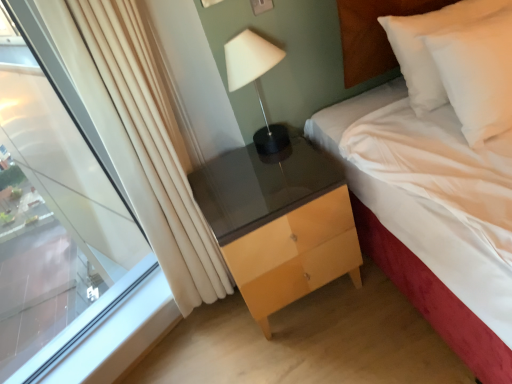
Question: Is white soft pillow at upper right at the right side of transparent glass window at left?

Choices:
 (A) no
 (B) yes

Answer: (B)

Question: Considering the relative sizes of white soft pillow at upper right and transparent glass window at left in the image provided, is white soft pillow at upper right wider than transparent glass window at left?

Choices:
 (A) yes
 (B) no

Answer: (A)

Question: Considering the relative sizes of white soft pillow at upper right and transparent glass window at left in the image provided, is white soft pillow at upper right shorter than transparent glass window at left?

Choices:
 (A) no
 (B) yes

Answer: (B)

Question: Is white soft pillow at upper right taller than transparent glass window at left?

Choices:
 (A) yes
 (B) no

Answer: (B)

Question: Does white soft pillow at upper right have a smaller size compared to transparent glass window at left?

Choices:
 (A) no
 (B) yes

Answer: (B)

Question: Is transparent glass window at left in front of or behind matte wood chest of drawers at center in the image?

Choices:
 (A) behind
 (B) front

Answer: (B)

Question: Considering the positions of transparent glass window at left and matte wood chest of drawers at center in the image, is transparent glass window at left bigger or smaller than matte wood chest of drawers at center?

Choices:
 (A) small
 (B) big

Answer: (B)

Question: In terms of width, does transparent glass window at left look wider or thinner when compared to matte wood chest of drawers at center?

Choices:
 (A) wide
 (B) thin

Answer: (B)

Question: From a real-world perspective, relative to matte wood chest of drawers at center, is transparent glass window at left vertically above or below?

Choices:
 (A) below
 (B) above

Answer: (B)

Question: From the image's perspective, is matte wood chest of drawers at center located above or below transparent glass window at left?

Choices:
 (A) below
 (B) above

Answer: (A)

Question: Is matte wood chest of drawers at center inside or outside of transparent glass window at left?

Choices:
 (A) inside
 (B) outside

Answer: (B)

Question: Looking at the image, does matte wood chest of drawers at center seem bigger or smaller compared to transparent glass window at left?

Choices:
 (A) small
 (B) big

Answer: (A)

Question: In the image, is matte wood chest of drawers at center positioned in front of or behind transparent glass window at left?

Choices:
 (A) front
 (B) behind

Answer: (B)

Question: From the image's perspective, is matte black lamp at upper center above or below white soft pillow at upper right?

Choices:
 (A) below
 (B) above

Answer: (A)

Question: Is matte black lamp at upper center in front of or behind white soft pillow at upper right in the image?

Choices:
 (A) behind
 (B) front

Answer: (A)